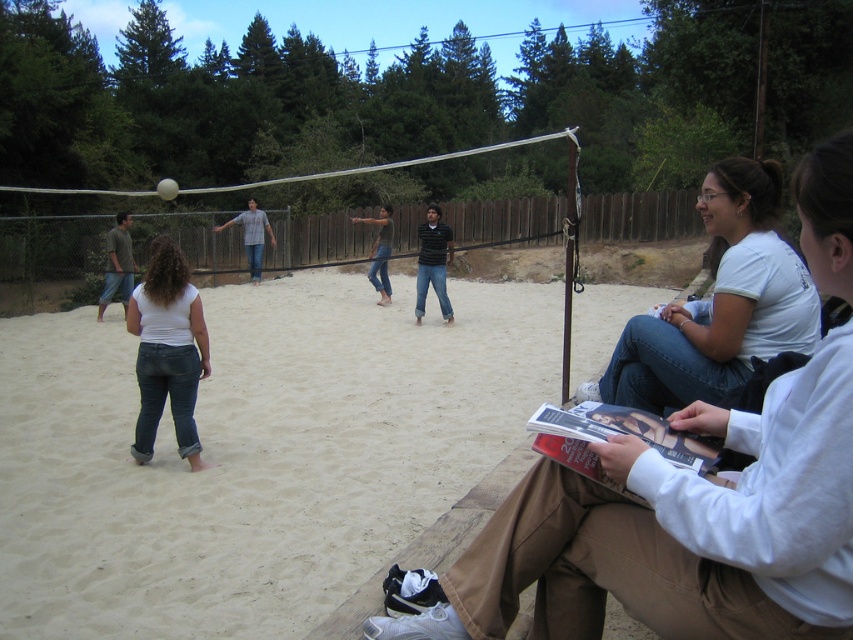
You are standing at the center of the volleyball court and want to place a small cooler exactly where the jeans at center are located. What are the coordinates you should aim for?

The coordinates for the jeans at center are 0.831 in the x direction and 0.795 in the y direction, so you should aim for point (677, 531).

You are standing at the center of the volleyball court and want to place a small cooler exactly where the jeans at center are located. What coordinates should you use to place the cooler?

The jeans at center are located at coordinates point (677, 531), so you should place the cooler at those coordinates.